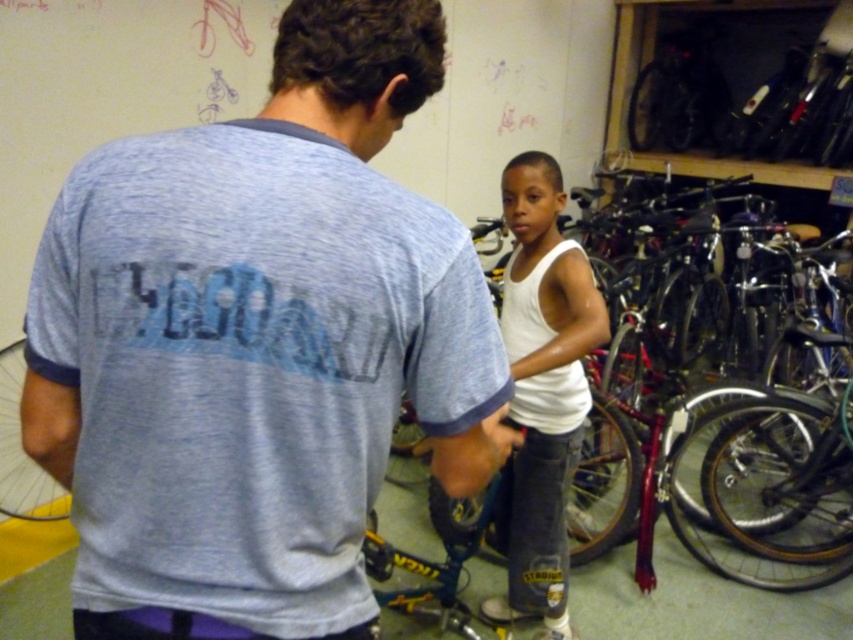
You are a photographer trying to capture the light blue heathered t shirt at center. You have a camera with a zoom lens that can focus on objects within a 0.15 unit radius. Given that the point marking the light blue heathered t shirt at center is located at coordinates (257, 344), will your camera be able to focus on it if you position the crosshairs at 0.5, 0.3?

The distance between the crosshairs at 0.5, 0.3 and the point at (257, 344) is sqrt of squared differences. Calculating sqrt of squared differences between 0.539 and 0.5 is 0.039, and between 0.302 and 0.3 is 0.002. Squaring those gives 0.001521 and 0.000004, adding to 0.001525. Square root is approximately 0.039. Since 0.039 is less than 0.15, the camera can focus on the light blue heathered t shirt at center.